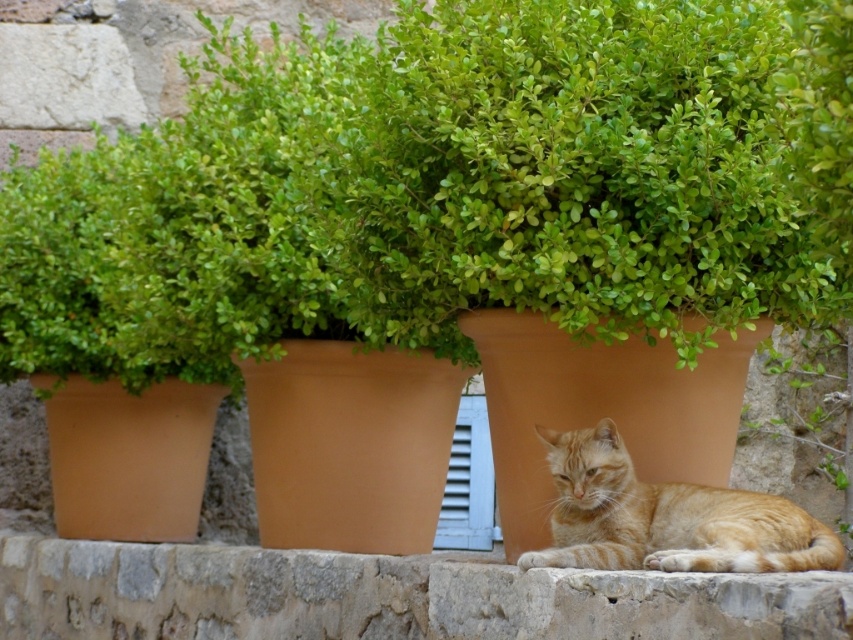
You are a photographer trying to capture the orange tabby cat at lower center and the white plastic window at center in the same frame. Which object will appear bigger in your photo?

The orange tabby cat at lower center will appear bigger in the photo because it has a larger size compared to the white plastic window at center.

You are a photographer standing at the camera position. You want to take a closeup shot of the orange tabby cat at lower center. The camera can focus on subjects within 10 feet. Can you take the closeup without moving closer?

The orange tabby cat at lower center is 20.86 feet away from the camera, which is beyond the 10 feet focus range. Therefore, you cannot take the closeup without moving closer.

You are an interior designer assessing the space shown in the image. You need to determine if the orange tabby cat at lower center can fit through the white plastic window at center. Based on their sizes, can the cat pass through the window?

The orange tabby cat at lower center is larger in width than the white plastic window at center, so the cat cannot pass through the window.